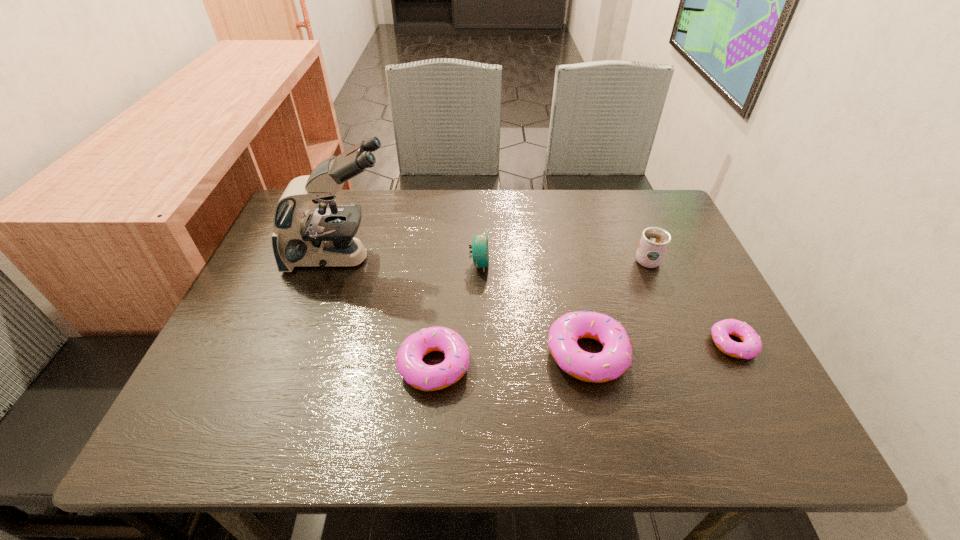
Find the location of a particular element. doughnut that is at the right edge is located at coordinates (752, 345).

Identify the location of cup that is positioned at the right edge. (654, 242).

Where is `object that is at the far left corner`? Image resolution: width=960 pixels, height=540 pixels. object that is at the far left corner is located at coordinates (323, 237).

At what (x,y) coordinates should I click in order to perform the action: click on free space at the far edge of the desktop. Please return your answer as a coordinate pair (x, y). Looking at the image, I should click on (434, 225).

Identify the location of free region at the near edge of the desktop. (663, 364).

In the image, there is a desktop. At what (x,y) coordinates should I click in order to perform the action: click on free space at the left edge. Please return your answer as a coordinate pair (x, y). The image size is (960, 540). Looking at the image, I should click on (267, 254).

I want to click on blank space at the far right corner of the desktop, so click(685, 235).

Find the location of a particular element. free space at the near right corner is located at coordinates (741, 376).

I want to click on empty location between the leftmost object and the second doughnut from left to right, so (464, 306).

This screenshot has width=960, height=540. What are the coordinates of `free point between the third object from right to left and the cup` in the screenshot? It's located at (616, 307).